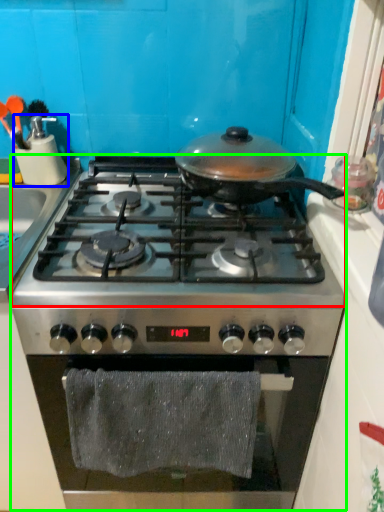
Question: Which object is the farthest from gas stove (highlighted by a red box)? Choose among these: kitchen appliance (highlighted by a blue box) or gas stove (highlighted by a green box).

Choices:
 (A) kitchen appliance
 (B) gas stove

Answer: (A)